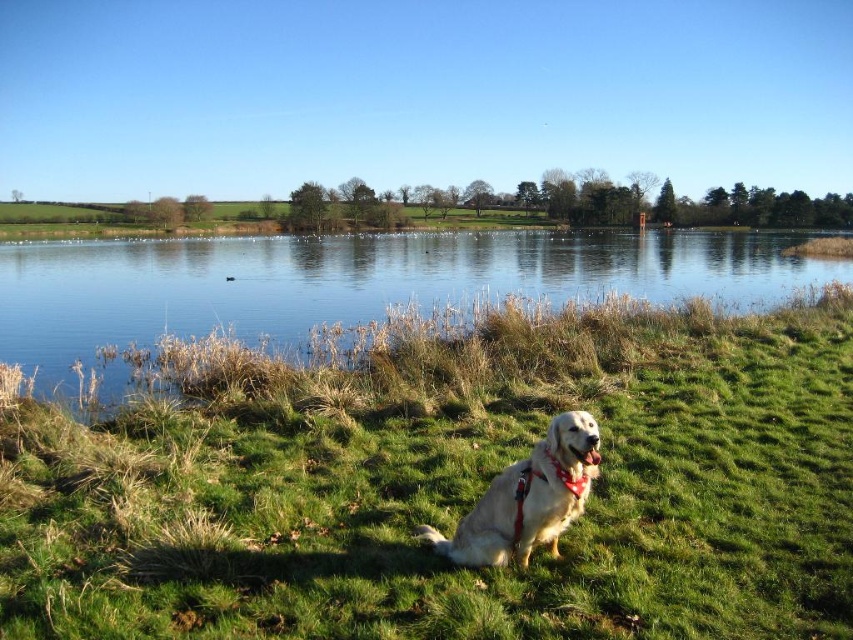
Question: Among these objects, which one is nearest to the camera?

Choices:
 (A) golden fur dog at lower center
 (B) green grassy at lower center

Answer: (B)

Question: Among these objects, which one is nearest to the camera?

Choices:
 (A) green grassy at lower center
 (B) clear water at lake center

Answer: (A)

Question: Does clear water at lake center have a smaller size compared to golden fur dog at lower center?

Choices:
 (A) no
 (B) yes

Answer: (A)

Question: Can you confirm if green grassy at lower center is positioned to the left of clear water at lake center?

Choices:
 (A) no
 (B) yes

Answer: (A)

Question: Can you confirm if green grassy at lower center is positioned above golden fur dog at lower center?

Choices:
 (A) no
 (B) yes

Answer: (B)

Question: Which object appears closest to the camera in this image?

Choices:
 (A) green grassy at lower center
 (B) clear water at lake center
 (C) golden fur dog at lower center

Answer: (A)